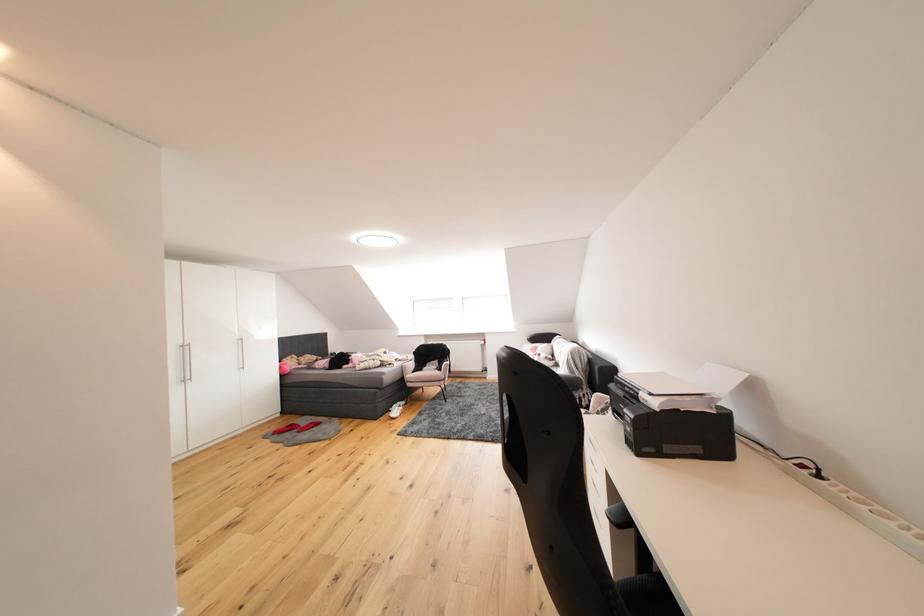
Find where to sit the chair sitting surface. Please return your answer as a coordinate pair (x, y).

(647, 594)